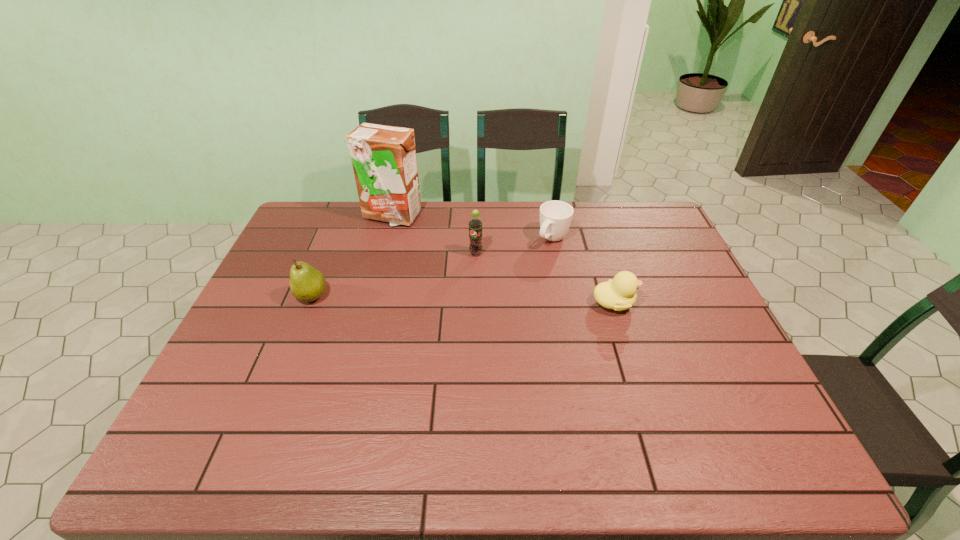
I want to click on free region that satisfies the following two spatial constraints: 1. on the back side of the cup; 2. on the right side of the pear, so click(335, 239).

Image resolution: width=960 pixels, height=540 pixels. I want to click on vacant space that satisfies the following two spatial constraints: 1. on the back side of the pear; 2. on the right side of the soda, so click(x=329, y=254).